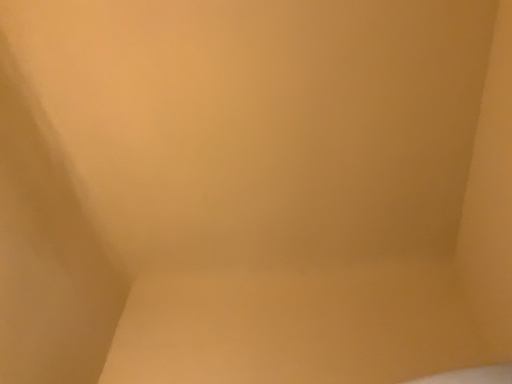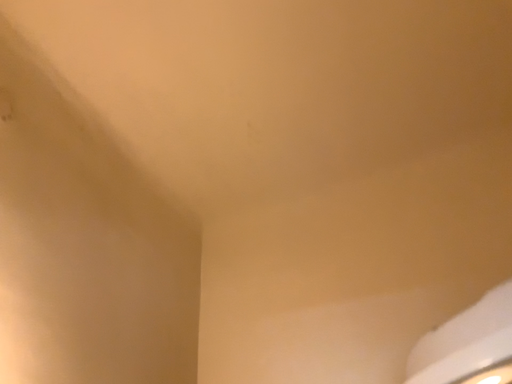
Question: Which way did the camera rotate in the video?

Choices:
 (A) rotated downward
 (B) rotated upward

Answer: (A)